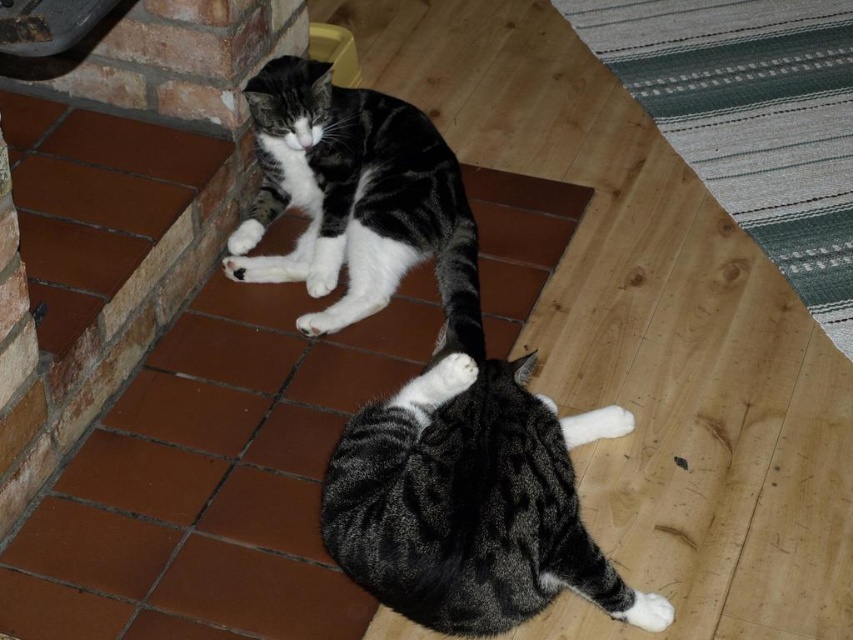
Question: Estimate the real-world distances between objects in this image. Which object is farther from the soft fur cat at lower right?

Choices:
 (A) white soft fur paw at lower right
 (B) white fur at lower left
 (C) white fur paw at lower center
 (D) black and white fur cat at upper left

Answer: (B)

Question: Can you confirm if soft fur cat at lower right is wider than white fur at lower center?

Choices:
 (A) no
 (B) yes

Answer: (B)

Question: Observing the image, what is the correct spatial positioning of soft fur cat at lower right in reference to white fur paw at lower center?

Choices:
 (A) below
 (B) above

Answer: (A)

Question: Which point is farther to the camera?

Choices:
 (A) white soft fur paw at lower right
 (B) white fur at lower center

Answer: (B)

Question: Can you confirm if white soft fur paw at lower right is positioned to the right of white fur at lower left?

Choices:
 (A) no
 (B) yes

Answer: (B)

Question: Which point is farther to the camera?

Choices:
 (A) (427, 506)
 (B) (293, 67)
 (C) (314, 273)

Answer: (C)